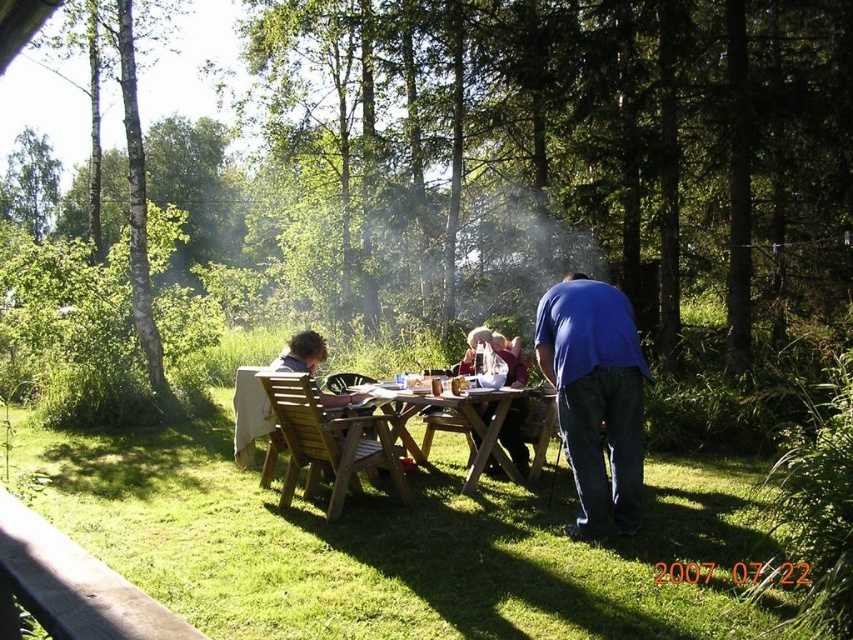
You are planning to set up a small tent near the wooden table at center and the wooden picnic table at center. Since you want the tent to be closer to the picnic table, which object should you place the tent behind?

You should place the tent behind the wooden table at center because it is in front of the wooden picnic table at center, so placing the tent behind the wooden table at center will position it closer to the picnic table.

You are standing at the picnic table in the forest scene. You notice two points marked in the image. The first point is at coordinates point (x=566, y=420) and the second point is at point (x=445, y=417). Which of these two points is closer to you?

Point (x=566, y=420) is in front of point (x=445, y=417), so it is closer to you.

You are planning to set up a small tent near the wooden table at center and the blue fabric shirt at right. Considering their heights, which object should you place the tent closer to so it doesn

The wooden table at center has a lesser height compared to blue fabric shirt at right, so you should place the tent closer to the blue fabric shirt at right to ensure it doesn